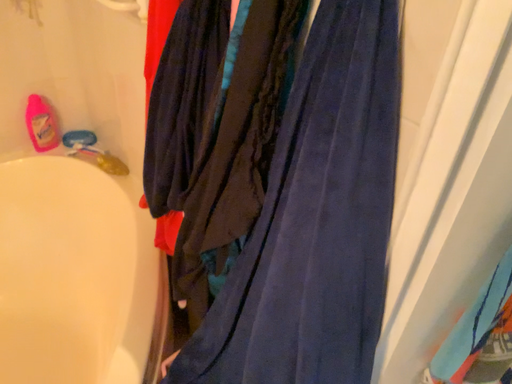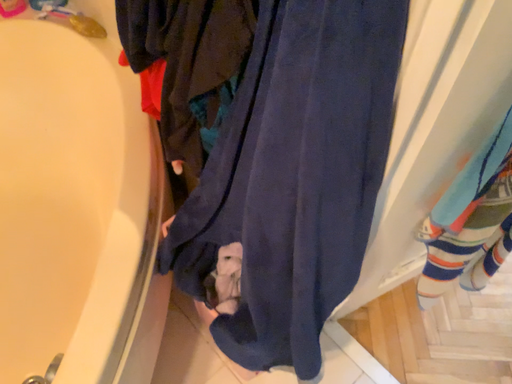
Question: How did the camera likely rotate when shooting the video?

Choices:
 (A) rotated downward
 (B) rotated upward

Answer: (A)